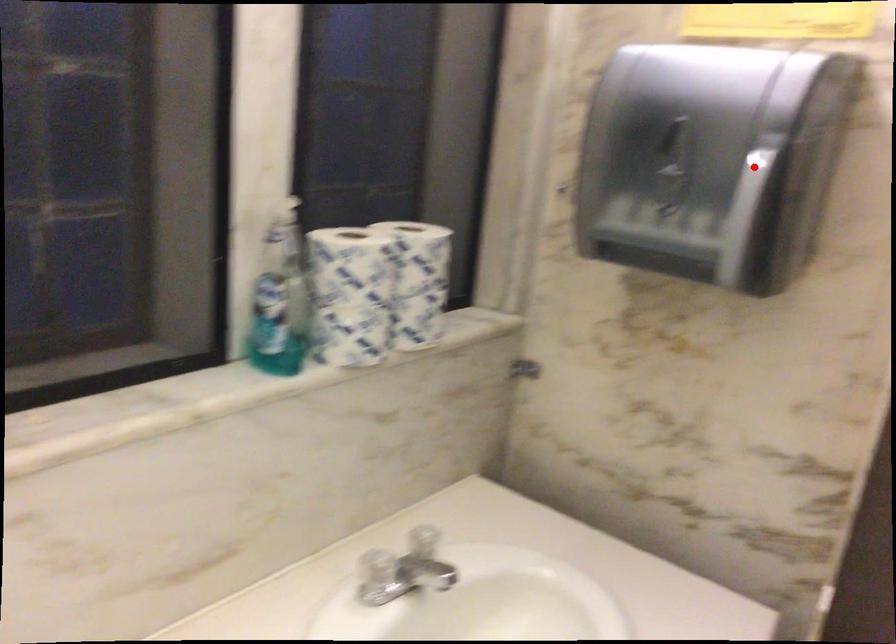
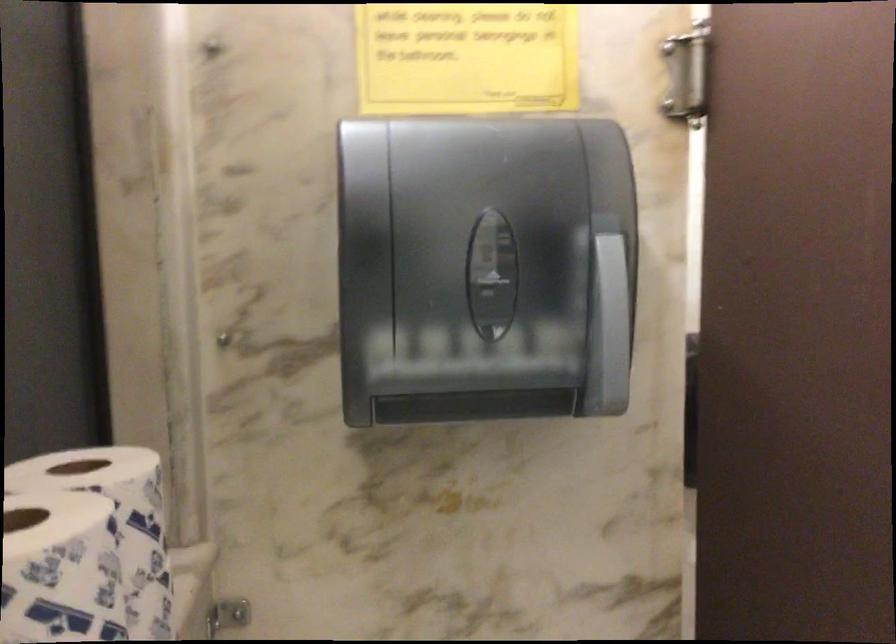
Question: A red point is marked in image1. In image2, is the corresponding 3D point closer to the camera or farther? Reply with the corresponding letter.

Choices:
 (A) The corresponding 3D point is closer.
 (B) The corresponding 3D point is farther.

Answer: (A)